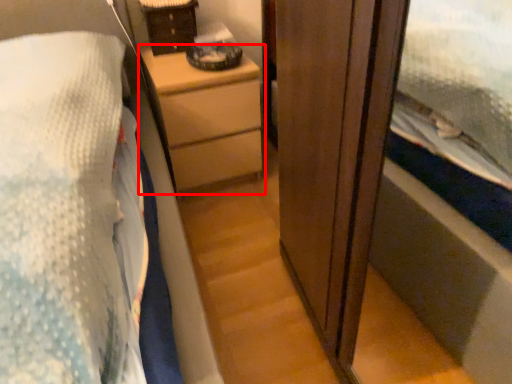
Question: From the image's perspective, considering the relative positions of chest of drawers (annotated by the red box) and cabinetry in the image provided, where is chest of drawers (annotated by the red box) located with respect to the staircase?

Choices:
 (A) below
 (B) above

Answer: (A)